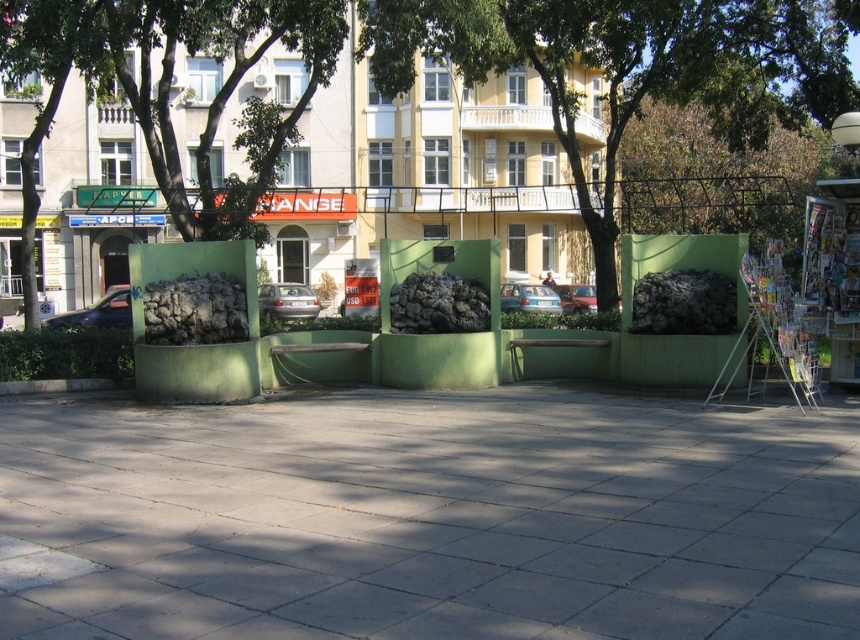
From the picture: Between gray concrete pavement at center and green leafy tree at center, which one appears on the left side from the viewer's perspective?

gray concrete pavement at center

The height and width of the screenshot is (640, 860). What do you see at coordinates (430, 518) in the screenshot?
I see `gray concrete pavement at center` at bounding box center [430, 518].

You are a GUI agent. You are given a task and a screenshot of the screen. Output one action in this format:
    pyautogui.click(x=<x>, y=<y>)
    Task: Click on the gray concrete pavement at center
    
    Given the screenshot: What is the action you would take?
    pyautogui.click(x=430, y=518)